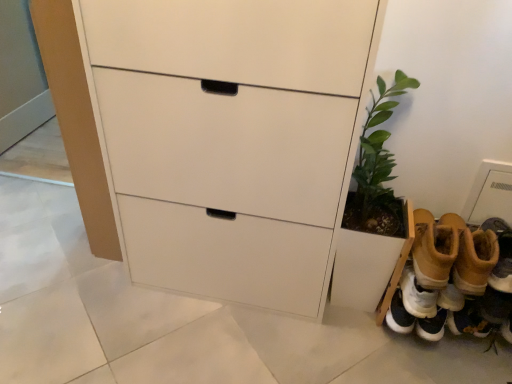
Question: From a real-world perspective, is white matte chest of drawers at center physically located above or below green leafy plant at lower right?

Choices:
 (A) below
 (B) above

Answer: (B)

Question: In terms of width, does white matte chest of drawers at center look wider or thinner when compared to green leafy plant at lower right?

Choices:
 (A) thin
 (B) wide

Answer: (B)

Question: Estimate the real-world distances between objects in this image. Which object is farther from the tan suede boots at lower right, positioned as the first footwear in right-to-left order?

Choices:
 (A) green leafy plant at lower right
 (B) tan suede boots at lower right, which appears as the 2th footwear when viewed from the right
 (C) white matte chest of drawers at center

Answer: (C)

Question: Considering the real-world distances, which object is farthest from the green leafy plant at lower right?

Choices:
 (A) tan suede boots at lower right, placed as the second footwear when sorted from left to right
 (B) tan suede boots at lower right, which appears as the 2th footwear when viewed from the right
 (C) white matte chest of drawers at center

Answer: (C)